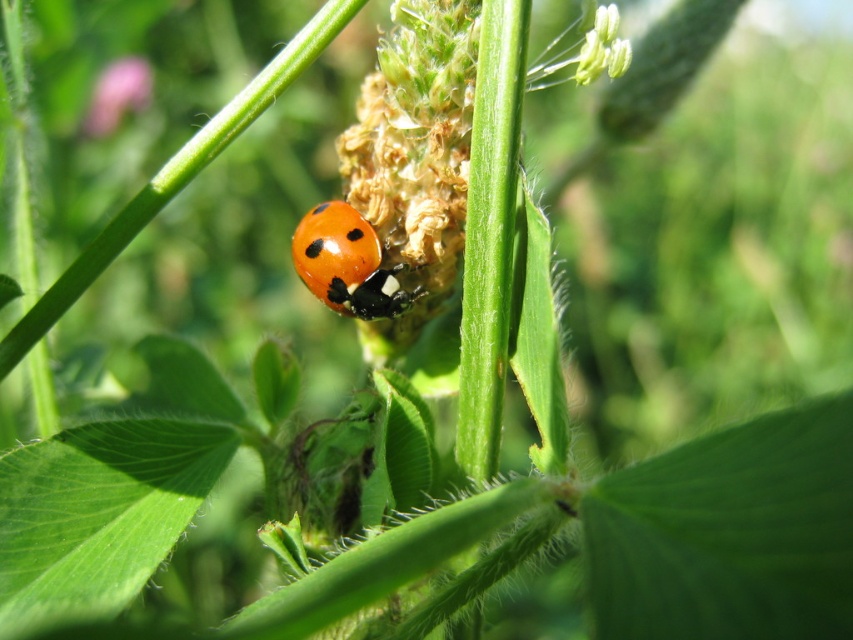
You are a photographer trying to capture the shiny orange ladybird at center and the smooth pink flower at upper left in a single frame. Based on their sizes in the image, which object would require you to adjust your camera focus more carefully to ensure both are in focus?

The shiny orange ladybird at center occupies less space than the smooth pink flower at upper left, so the smaller size of the shiny orange ladybird at center may require more precise focus adjustment to ensure it is clear alongside the larger flower.

What is located at the point marked by coordinates (347, 262) in the image?

The point marked by coordinates (347, 262) is where the shiny orange ladybird at center is located.